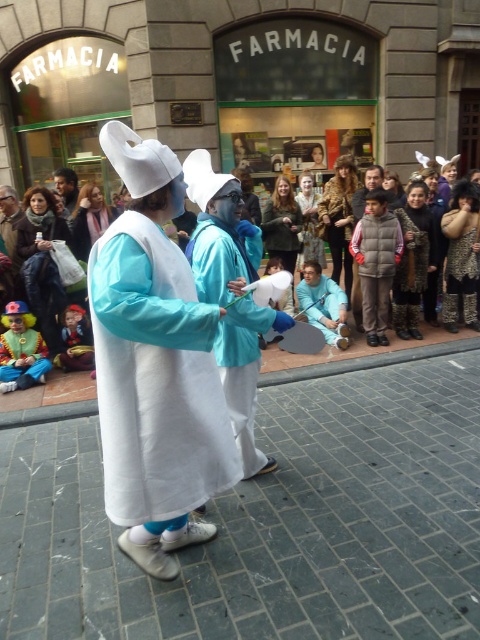
You are a delivery person who needs to place a package between the white fabric at center and the matte white mask at center. Can you fit the package there if it measures 14 feet in length?

The distance between the white fabric at center and the matte white mask at center is 13.72 feet, which is shorter than the package length of 14 feet. Therefore, the package cannot fit between them.

You are a costume designer looking at the Smurf characters in the scene. Which costume element, the matte blue coat at center or the matte white coat at center, is positioned higher on the Smurf?

The matte blue coat at center is located above the matte white coat at center, so the matte blue coat at center is positioned higher on the Smurf.